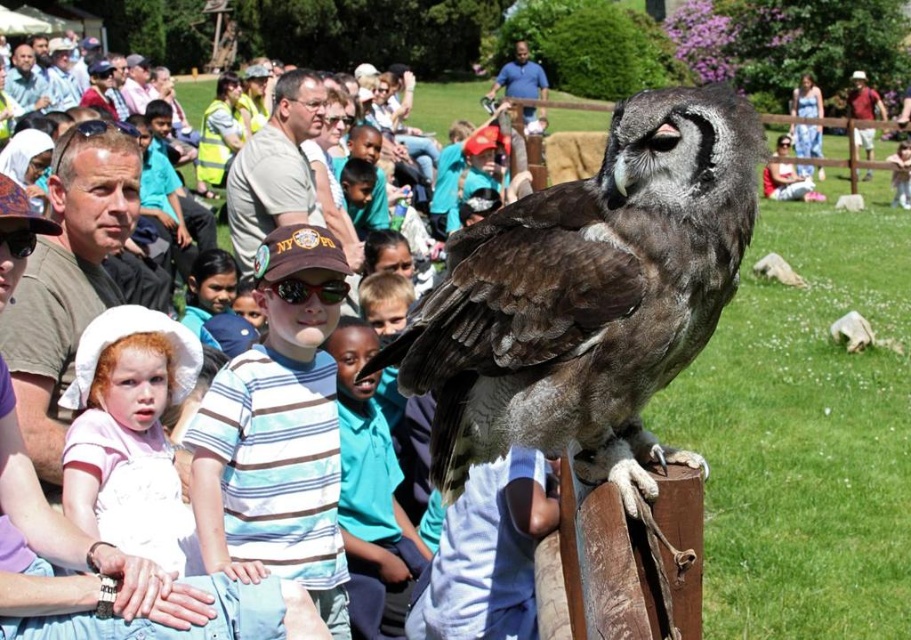
You are a photographer standing in front of the wooden post with the owl. You notice both the dark brown feathers at center and the striped cotton shirt at center in your viewfinder. Which object should you focus on to ensure it appears larger in your photo?

The dark brown feathers at center is closer to the viewer than the striped cotton shirt at center, so focusing on the dark brown feathers at center will make it appear larger in the photo.

You are organizing a photo shoot and need to arrange the striped cotton shirt at center and the pink fabric dress at left based on their sizes. Which clothing item should be placed first if you want to start with the larger one?

The striped cotton shirt at center should be placed first since it is larger in size than the pink fabric dress at left.